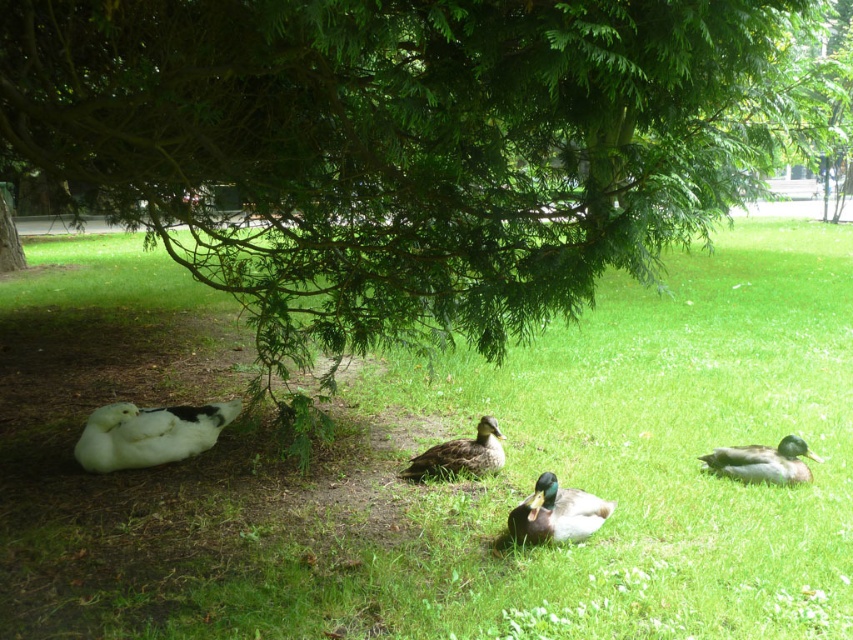
Question: Is white fluffy duck at left further to the viewer compared to green glossy duck at center?

Choices:
 (A) no
 (B) yes

Answer: (B)

Question: Estimate the real-world distances between objects in this image. Which object is closer to the green glossy duck at center?

Choices:
 (A) green leafy tree at center
 (B) green glossy duck at lower right
 (C) brown matte duck at center
 (D) green grass at lower center

Answer: (C)

Question: Does green glossy duck at center have a smaller size compared to brown matte duck at center?

Choices:
 (A) no
 (B) yes

Answer: (B)

Question: Does green grass at lower center have a lesser width compared to brown matte duck at center?

Choices:
 (A) yes
 (B) no

Answer: (B)

Question: Based on their relative distances, which object is nearer to the brown matte duck at center?

Choices:
 (A) green leafy tree at center
 (B) green glossy duck at center
 (C) green glossy duck at lower right

Answer: (B)

Question: Which object appears farthest from the camera in this image?

Choices:
 (A) green glossy duck at center
 (B) green glossy duck at lower right
 (C) green leafy tree at center

Answer: (B)